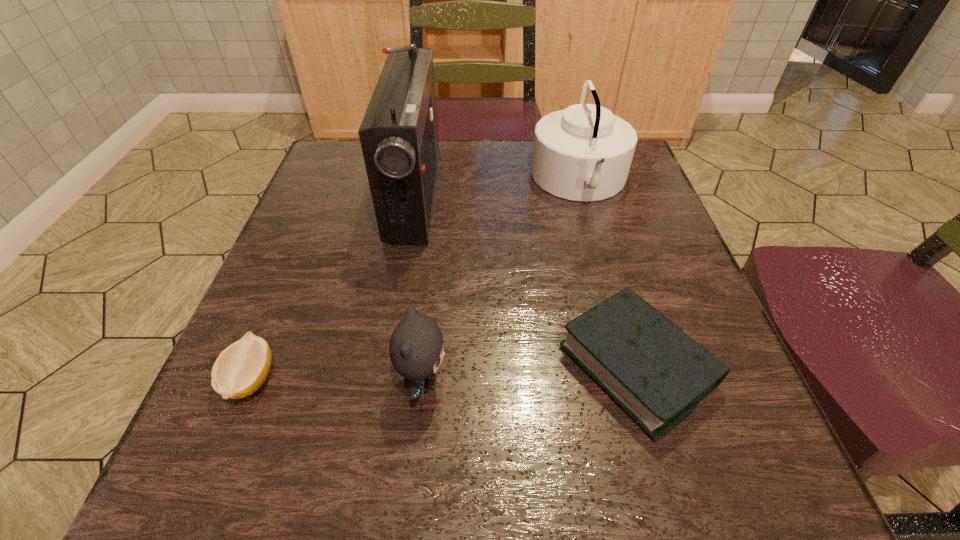
Where is `vacant space at the far edge of the desktop`? The image size is (960, 540). vacant space at the far edge of the desktop is located at coordinates pyautogui.click(x=458, y=164).

The image size is (960, 540). In the image, there is a desktop. In order to click on vacant space at the near edge in this screenshot , I will do `click(541, 449)`.

Locate an element on the screen. The height and width of the screenshot is (540, 960). free space at the left edge of the desktop is located at coordinates (330, 235).

Identify the location of free location at the far left corner. (334, 145).

This screenshot has height=540, width=960. In order to click on free space at the near left corner in this screenshot , I will do `click(221, 489)`.

Where is `free space at the near right corner of the desktop`? free space at the near right corner of the desktop is located at coordinates (731, 441).

The height and width of the screenshot is (540, 960). I want to click on vacant region between the tallest object and the leftmost object, so pos(332,286).

Where is `vacant space that is in between the kettle and the Bible`? This screenshot has height=540, width=960. vacant space that is in between the kettle and the Bible is located at coordinates (609, 273).

Locate an element on the screen. vacant area between the tallest object and the Bible is located at coordinates (526, 280).

The image size is (960, 540). I want to click on free space between the lemon and the kettle, so click(x=415, y=280).